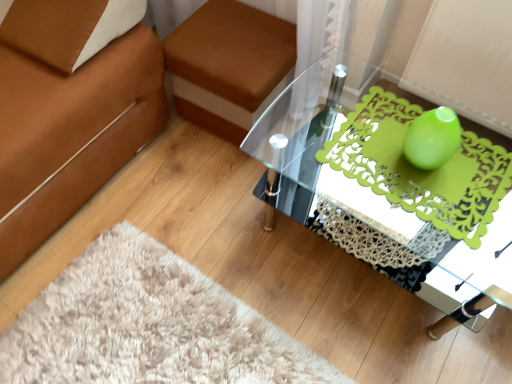
Question: From the image's perspective, is teal glass vase at center under green matte vase at upper right?

Choices:
 (A) no
 (B) yes

Answer: (A)

Question: Can you confirm if teal glass vase at center is taller than green matte vase at upper right?

Choices:
 (A) yes
 (B) no

Answer: (A)

Question: Can you confirm if teal glass vase at center is wider than green matte vase at upper right?

Choices:
 (A) no
 (B) yes

Answer: (A)

Question: Can you confirm if teal glass vase at center is shorter than green matte vase at upper right?

Choices:
 (A) yes
 (B) no

Answer: (B)

Question: From the image's perspective, is teal glass vase at center above green matte vase at upper right?

Choices:
 (A) yes
 (B) no

Answer: (A)

Question: Is teal glass vase at center completely or partially outside of green matte vase at upper right?

Choices:
 (A) yes
 (B) no

Answer: (A)

Question: From the image's perspective, does teal glass vase at center appear higher than transparent glass table at center?

Choices:
 (A) no
 (B) yes

Answer: (B)

Question: Considering the relative sizes of teal glass vase at center and transparent glass table at center in the image provided, is teal glass vase at center bigger than transparent glass table at center?

Choices:
 (A) no
 (B) yes

Answer: (A)

Question: Are teal glass vase at center and transparent glass table at center making contact?

Choices:
 (A) yes
 (B) no

Answer: (B)

Question: Is teal glass vase at center at the right side of transparent glass table at center?

Choices:
 (A) yes
 (B) no

Answer: (A)

Question: Considering the relative positions of teal glass vase at center and transparent glass table at center in the image provided, is teal glass vase at center to the left of transparent glass table at center from the viewer's perspective?

Choices:
 (A) no
 (B) yes

Answer: (A)

Question: Is transparent glass table at center completely or partially inside teal glass vase at center?

Choices:
 (A) yes
 (B) no

Answer: (B)

Question: Is brown fabric footrest at upper center positioned beyond the bounds of transparent glass table at center?

Choices:
 (A) yes
 (B) no

Answer: (A)